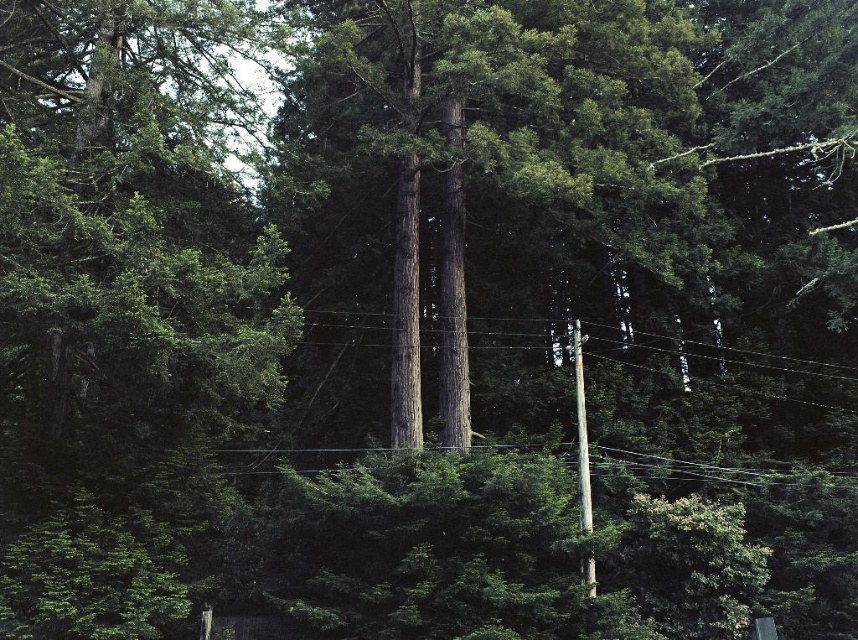
You are a bird trying to land on the brown wooden power line at center and the black wire at center. Which one would you choose if you want to land on the thicker one?

The black wire at center is thicker than the brown wooden power line at center, so you should choose the black wire at center.